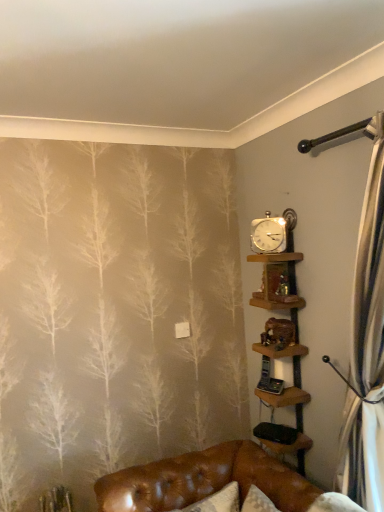
Question: Visually, is wooden shelves at upper right, acting as the 2th shelf starting from the top, positioned to the left or to the right of gold metallic clock at upper right?

Choices:
 (A) right
 (B) left

Answer: (A)

Question: Does point (274, 276) appear closer or farther from the camera than point (274, 232)?

Choices:
 (A) farther
 (B) closer

Answer: (A)

Question: Which is farther from the gold metallic clock at upper right?

Choices:
 (A) wooden shelves at upper right, the 1th shelf in the bottom-to-top sequence
 (B) wooden shelf at upper center, which appears as the 1th shelf when viewed from the top

Answer: (A)

Question: Based on their relative distances, which object is nearer to the gold metallic clock at upper right?

Choices:
 (A) wooden shelves at upper right, the 1th shelf in the bottom-to-top sequence
 (B) wooden shelf at upper center, marked as the 2th shelf in a bottom-to-top arrangement

Answer: (B)